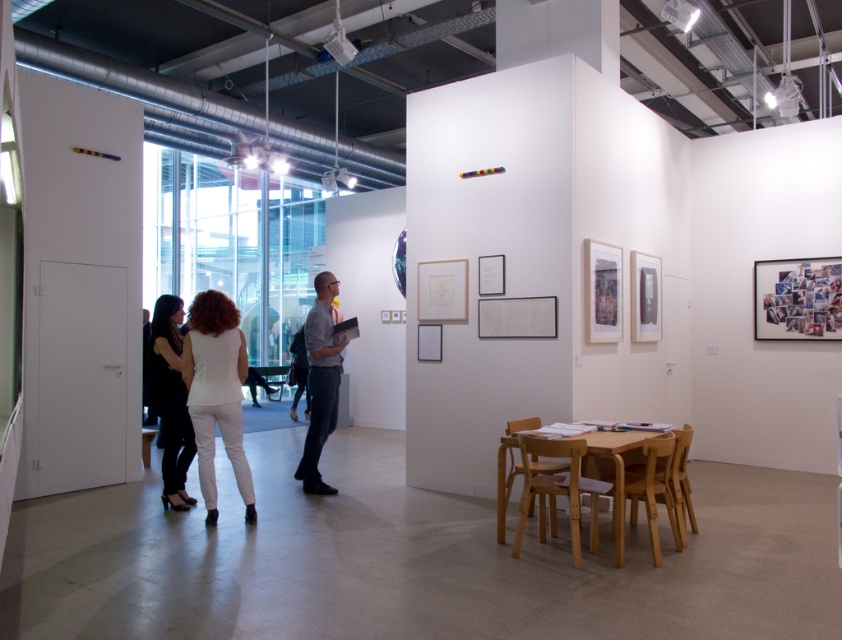
You are an art gallery visitor who wants to take a photo of the white matte pants at lower center and the black fabric dress at left. Which object should you focus on first if you want to capture both in one frame without moving the camera?

You should focus on the white matte pants at lower center first because it is above the black fabric dress at left, so by centering the pants, the dress will naturally be in the lower part of the frame, allowing both to be captured in one shot.

From the picture: You are an art enthusiast visiting the gallery and want to take a photo of the white matte pants at lower center without any obstruction. Based on the coordinates provided, can you determine if the pants are positioned in an area where you can easily access them for a clear shot?

The white matte pants at lower center are located at coordinates point [216,392], which likely places them in a central yet accessible area of the gallery. Since there are no obstructions mentioned in the scene description, you should be able to access them for a clear photo.

You are an art enthusiast standing in the gallery and want to move from point A to point B. Point A is at coordinate point(166,323) and point B is at coordinate point(329,276). According to the scene description, which point is closer to you when you are facing the glass wall on the left side?

Point(166,323) is in front of point(329,276), so when facing the glass wall on the left side, point(166,323) is closer to you.